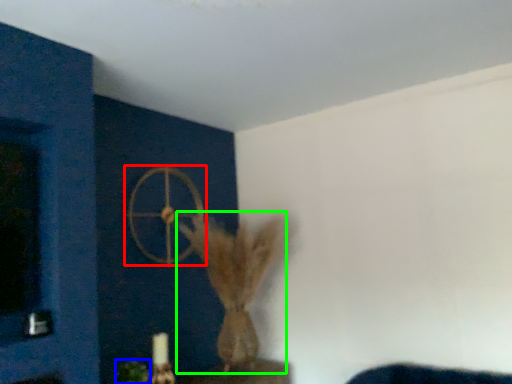
Question: Which object is the closest to the wheel (highlighted by a red box)? Choose among these: plant (highlighted by a blue box) or animal (highlighted by a green box).

Choices:
 (A) plant
 (B) animal

Answer: (B)